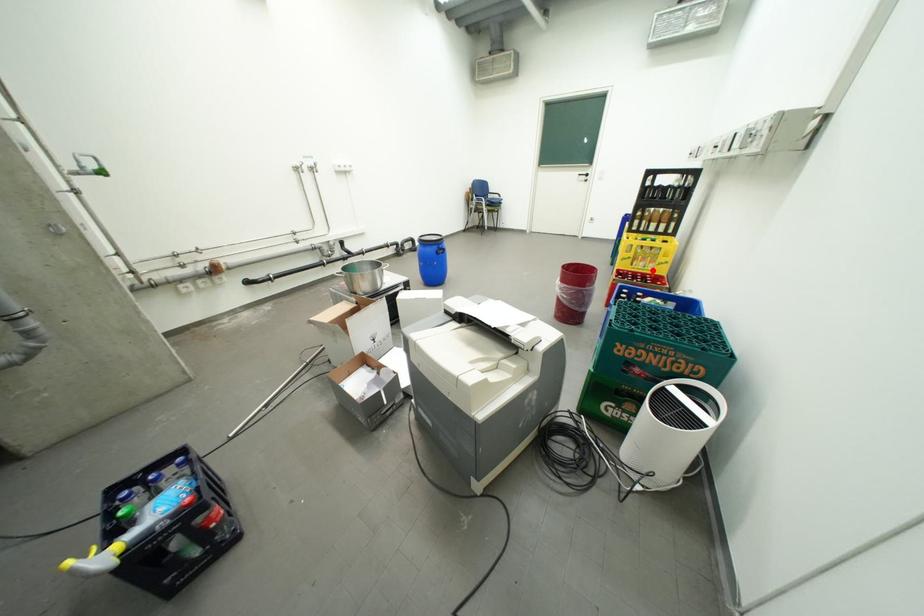
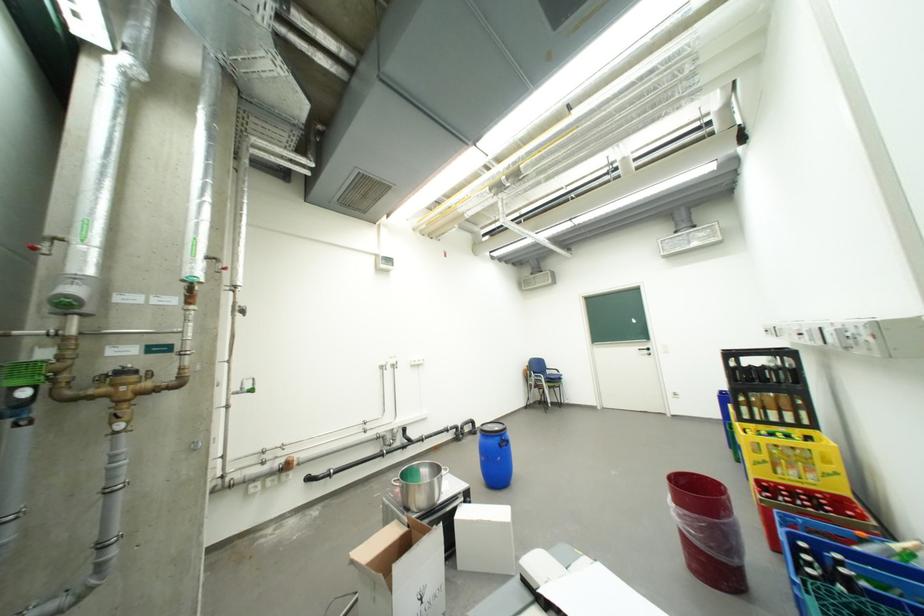
Locate, in the second image, the point that corresponds to the highlighted location in the first image.

(810, 484)